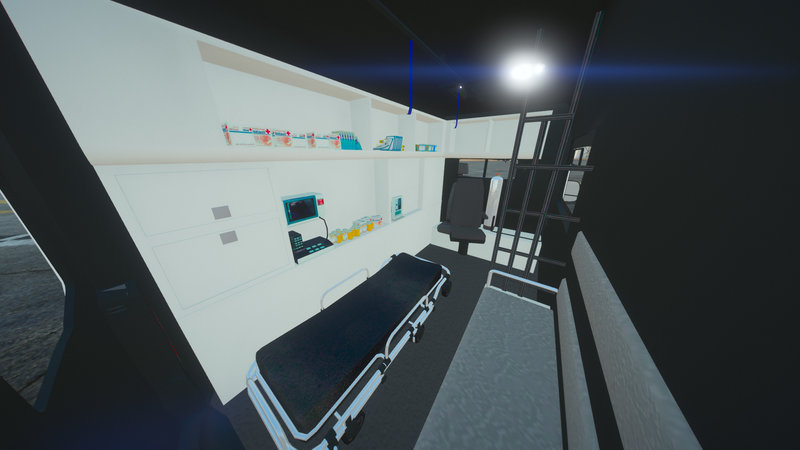
Image resolution: width=800 pixels, height=450 pixels. I want to click on chair, so click(466, 207).